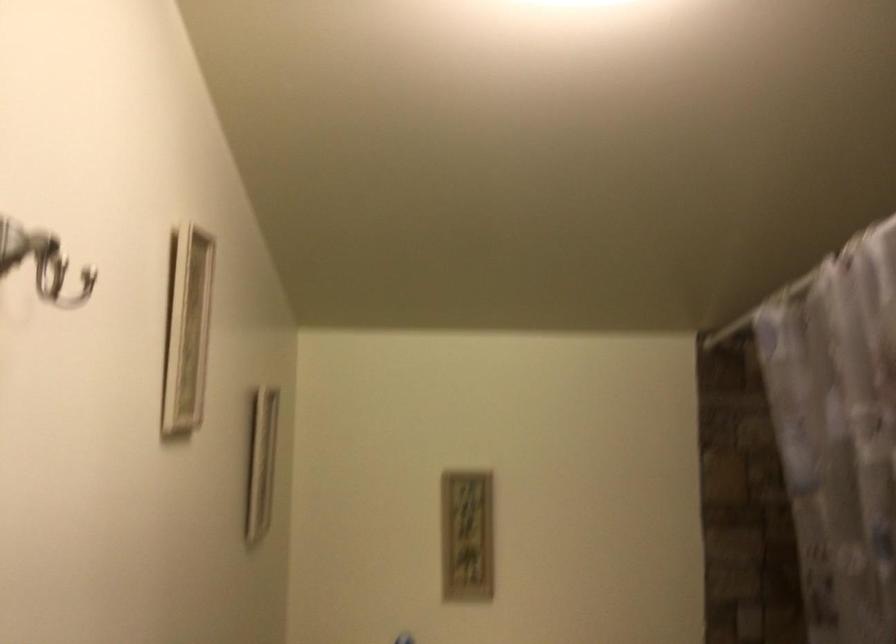
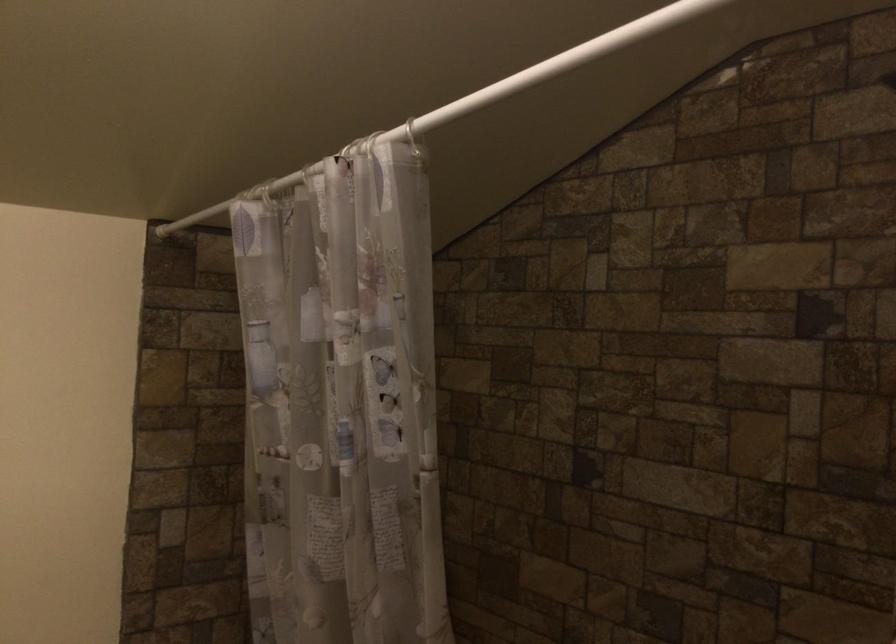
The point at [780,297] is marked in the first image. Where is the corresponding point in the second image?

(269, 194)